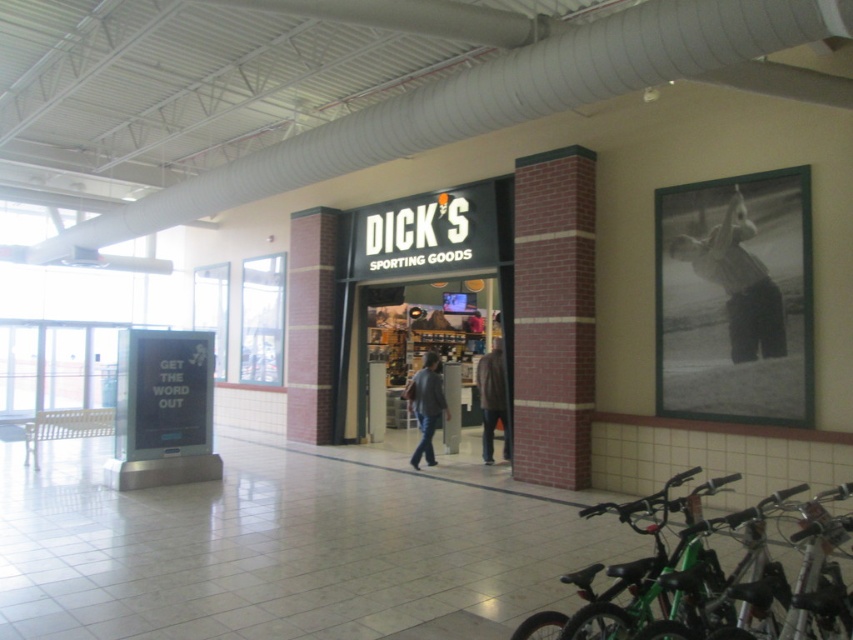
You are standing at the camera position in the mall. You want to walk to the point at coordinates point [715,483]. How far will you have to walk?

The point [715,483] is 26.63 feet away from the camera, so you will have to walk 26.63 feet to reach it.

You are a delivery person carrying a large box that is 1.5 meters wide. You need to navigate through the space between the green matte bicycle at lower right and the denim jacket at center. Can your box fit through that space?

The green matte bicycle at lower right is wider than the denim jacket at center. Since the box is 1.5 meters wide, it depends on the actual width of the narrowest point between them. However, since the bicycle is wider, the space might be narrower than 1.5 meters. Without exact measurements, it is uncertain if the box can fit.